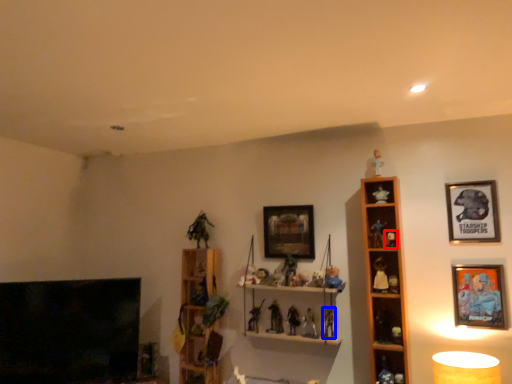
Question: Which object is closer to the camera taking this photo, toy (highlighted by a red box) or toy (highlighted by a blue box)?

Choices:
 (A) toy
 (B) toy

Answer: (A)